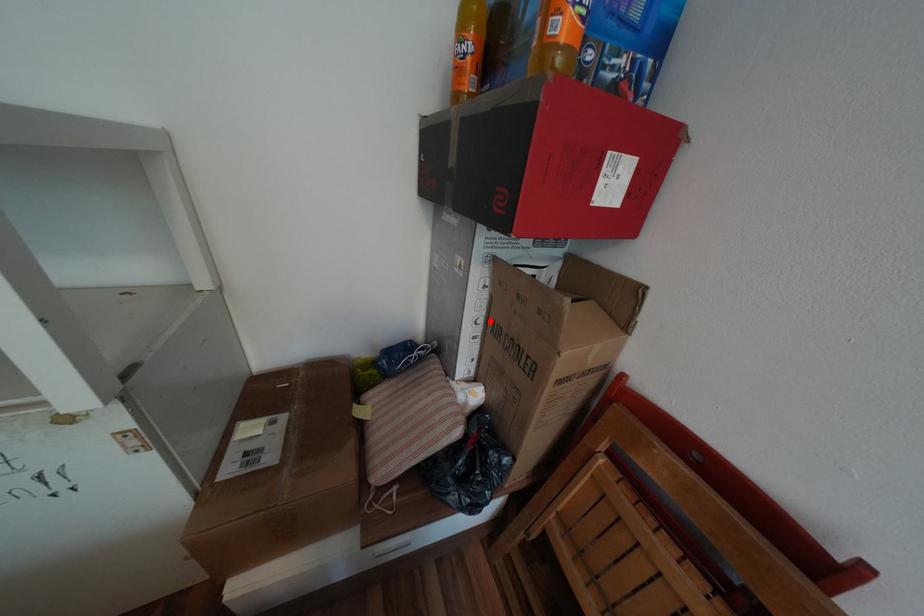
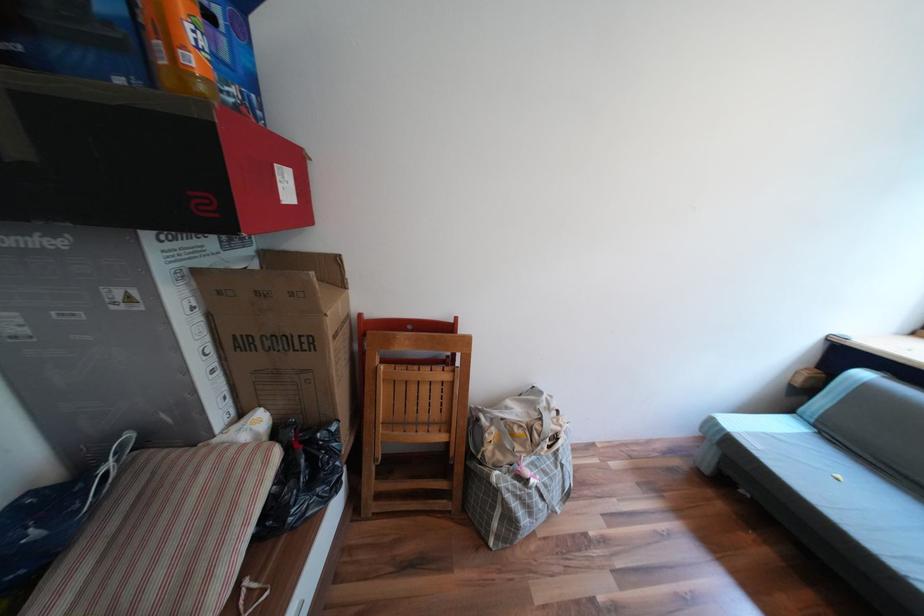
In the second image, find the point that corresponds to the highlighted location in the first image.

(219, 349)